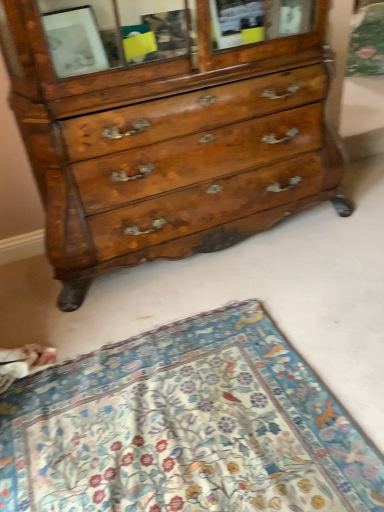
This screenshot has height=512, width=384. In order to click on free spot in front of shiny brown wood chest of drawers at center in this screenshot , I will do `click(206, 352)`.